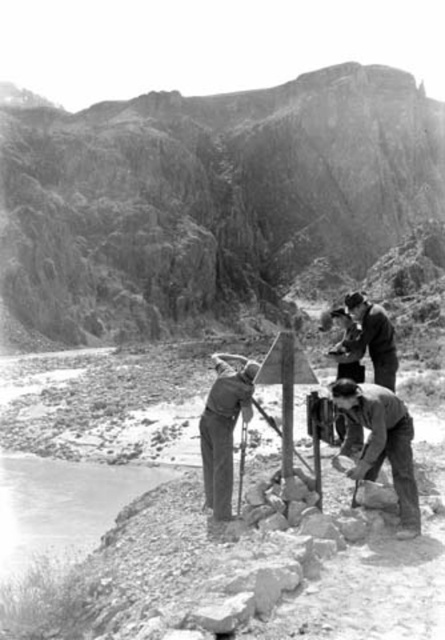
You are a hiker who needs to place a 1.5 meter long tent between the smooth gray pants at center and the metallic signpost at center. Is there enough space between them to set up the tent?

The distance between the smooth gray pants at center and the metallic signpost at center is 1.33 meters. Since the tent is 1.5 meters long, there isn t enough space to set it up between them.

You are a hiker who has just arrived at the riverbank shown in the image. You need to locate the metallic signpost at center to read its contents. Which direction should you move relative to the dark gray fabric shirt at lower right to reach it?

To reach the metallic signpost at center from the dark gray fabric shirt at lower right, you should move to the left since the metallic signpost at center is to the left of the dark gray fabric shirt at lower right.